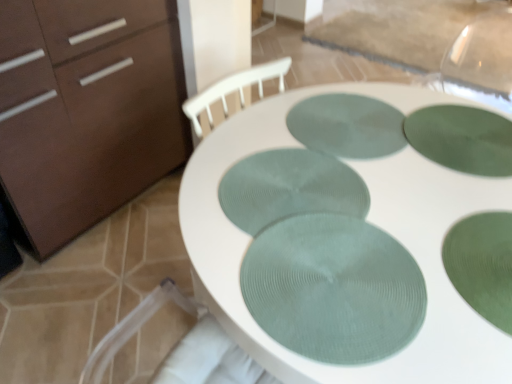
Image resolution: width=512 pixels, height=384 pixels. In order to click on spots to the right of green textured glass plate at center, the 3th glass plate viewed from the back in this screenshot , I will do `click(424, 198)`.